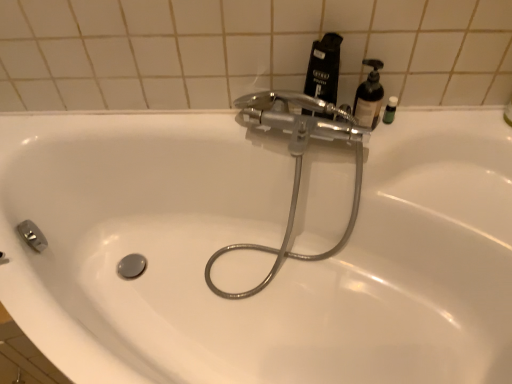
What is the approximate height of green matte bottle at upper right?

It is 2.89 inches.

Identify the location of polished chrome faucet at upper center. (295, 164).

Locate an element on the screen. The height and width of the screenshot is (384, 512). translucent plastic soap dispenser at upper right is located at coordinates click(369, 97).

You are a GUI agent. You are given a task and a screenshot of the screen. Output one action in this format:
    pyautogui.click(x=<x>, y=<y>)
    Task: Click on the green matte bottle at upper right
    The width and height of the screenshot is (512, 384).
    Given the screenshot: What is the action you would take?
    pyautogui.click(x=390, y=110)

Considering the positions of objects black matte bottle at upper right and polished chrome faucet at upper center in the image provided, who is in front, black matte bottle at upper right or polished chrome faucet at upper center?

polished chrome faucet at upper center is in front.

Is black matte bottle at upper right oriented away from polished chrome faucet at upper center?

No, black matte bottle at upper right's orientation is not away from polished chrome faucet at upper center.

You are a GUI agent. You are given a task and a screenshot of the screen. Output one action in this format:
    pyautogui.click(x=<x>, y=<y>)
    Task: Click on the plumbing fixture that appears on the left of black matte bottle at upper right
    This screenshot has width=512, height=384.
    Given the screenshot: What is the action you would take?
    pyautogui.click(x=295, y=164)

Considering the sizes of black matte bottle at upper right and polished chrome faucet at upper center in the image, is black matte bottle at upper right wider or thinner than polished chrome faucet at upper center?

black matte bottle at upper right is thinner than polished chrome faucet at upper center.

In terms of width, does green matte bottle at upper right look wider or thinner when compared to translucent plastic soap dispenser at upper right?

Considering their sizes, green matte bottle at upper right looks slimmer than translucent plastic soap dispenser at upper right.

Is point (390, 101) closer or farther from the camera than point (379, 77)?

Clearly, point (390, 101) is more distant from the camera than point (379, 77).

From the image's perspective, between green matte bottle at upper right and translucent plastic soap dispenser at upper right, which one is located above?

translucent plastic soap dispenser at upper right appears higher in the image.

Considering the sizes of objects green matte bottle at upper right and translucent plastic soap dispenser at upper right in the image provided, who is bigger, green matte bottle at upper right or translucent plastic soap dispenser at upper right?

translucent plastic soap dispenser at upper right is bigger.

Which is more to the left, black matte bottle at upper right or translucent plastic soap dispenser at upper right?

From the viewer's perspective, black matte bottle at upper right appears more on the left side.

Looking at this image, would you say black matte bottle at upper right is inside or outside translucent plastic soap dispenser at upper right?

The correct answer is: outside.

Is black matte bottle at upper right facing towards translucent plastic soap dispenser at upper right?

No, black matte bottle at upper right is not aimed at translucent plastic soap dispenser at upper right.

Which is behind, point (329, 33) or point (376, 96)?

Point (376, 96)

Considering the sizes of black matte bottle at upper right and green matte bottle at upper right in the image, is black matte bottle at upper right taller or shorter than green matte bottle at upper right?

Considering their sizes, black matte bottle at upper right has more height than green matte bottle at upper right.

From a real-world perspective, between black matte bottle at upper right and green matte bottle at upper right, who is vertically lower?

green matte bottle at upper right, from a real-world perspective.

Is black matte bottle at upper right aimed at green matte bottle at upper right?

No, black matte bottle at upper right is not facing towards green matte bottle at upper right.

Is black matte bottle at upper right located within translucent plastic soap dispenser at upper right?

No, translucent plastic soap dispenser at upper right does not contain black matte bottle at upper right.

Which object is further away from the camera taking this photo, translucent plastic soap dispenser at upper right or black matte bottle at upper right?

translucent plastic soap dispenser at upper right is further from the camera.

From a real-world perspective, is translucent plastic soap dispenser at upper right positioned under black matte bottle at upper right based on gravity?

Correct, in the physical world, translucent plastic soap dispenser at upper right is lower than black matte bottle at upper right.

Based on the photo, considering the sizes of translucent plastic soap dispenser at upper right and black matte bottle at upper right in the image, is translucent plastic soap dispenser at upper right taller or shorter than black matte bottle at upper right?

Considering their sizes, translucent plastic soap dispenser at upper right has less height than black matte bottle at upper right.

Which is less distant, (218, 290) or (359, 120)?

The point (359, 120) is in front.

Considering the relative sizes of polished chrome faucet at upper center and translucent plastic soap dispenser at upper right in the image provided, is polished chrome faucet at upper center smaller than translucent plastic soap dispenser at upper right?

Incorrect, polished chrome faucet at upper center is not smaller in size than translucent plastic soap dispenser at upper right.

Does polished chrome faucet at upper center touch translucent plastic soap dispenser at upper right?

No, polished chrome faucet at upper center is not next to translucent plastic soap dispenser at upper right.

From the image's perspective, is polished chrome faucet at upper center positioned above or below translucent plastic soap dispenser at upper right?

Clearly, from the image's perspective, polished chrome faucet at upper center is below translucent plastic soap dispenser at upper right.

Is green matte bottle at upper right aimed at polished chrome faucet at upper center?

Yes, green matte bottle at upper right is turned towards polished chrome faucet at upper center.

How far apart are green matte bottle at upper right and polished chrome faucet at upper center?

30.70 centimeters.

From the image's perspective, is green matte bottle at upper right under polished chrome faucet at upper center?

No, from the image's perspective, green matte bottle at upper right is not beneath polished chrome faucet at upper center.

Which of these two, green matte bottle at upper right or polished chrome faucet at upper center, is smaller?

green matte bottle at upper right is smaller.

Where is `plumbing fixture below the black matte bottle at upper right (from the image's perspective)`? The width and height of the screenshot is (512, 384). plumbing fixture below the black matte bottle at upper right (from the image's perspective) is located at coordinates (295, 164).

The height and width of the screenshot is (384, 512). What are the coordinates of `toiletry on the right side of translucent plastic soap dispenser at upper right` in the screenshot? It's located at (390, 110).

Based on their spatial positions, is black matte bottle at upper right or green matte bottle at upper right further from translucent plastic soap dispenser at upper right?

black matte bottle at upper right lies further to translucent plastic soap dispenser at upper right than the other object.

Considering their positions, is black matte bottle at upper right positioned further to polished chrome faucet at upper center than green matte bottle at upper right?

green matte bottle at upper right lies further to polished chrome faucet at upper center than the other object.

Based on their spatial positions, is polished chrome faucet at upper center or black matte bottle at upper right further from green matte bottle at upper right?

polished chrome faucet at upper center is positioned further to the anchor green matte bottle at upper right.

Based on their spatial positions, is black matte bottle at upper right or polished chrome faucet at upper center closer to translucent plastic soap dispenser at upper right?

Based on the image, black matte bottle at upper right appears to be nearer to translucent plastic soap dispenser at upper right.

From the image, which object appears to be farther from polished chrome faucet at upper center, green matte bottle at upper right or translucent plastic soap dispenser at upper right?

green matte bottle at upper right.

Estimate the real-world distances between objects in this image. Which object is further from polished chrome faucet at upper center, green matte bottle at upper right or black matte bottle at upper right?

green matte bottle at upper right is further to polished chrome faucet at upper center.

Looking at the image, which one is located closer to black matte bottle at upper right, green matte bottle at upper right or polished chrome faucet at upper center?

polished chrome faucet at upper center is closer to black matte bottle at upper right.

Looking at the image, which one is located further to translucent plastic soap dispenser at upper right, green matte bottle at upper right or black matte bottle at upper right?

black matte bottle at upper right lies further to translucent plastic soap dispenser at upper right than the other object.

Find the location of `soap dispenser located between polished chrome faucet at upper center and green matte bottle at upper right in the depth direction`. soap dispenser located between polished chrome faucet at upper center and green matte bottle at upper right in the depth direction is located at coordinates (369, 97).

I want to click on soap dispenser between black matte bottle at upper right and green matte bottle at upper right, so click(x=369, y=97).

You are a GUI agent. You are given a task and a screenshot of the screen. Output one action in this format:
    pyautogui.click(x=<x>, y=<y>)
    Task: Click on the soap dispenser between black matte bottle at upper right and polished chrome faucet at upper center from top to bottom
    
    Given the screenshot: What is the action you would take?
    pyautogui.click(x=369, y=97)

At what (x,y) coordinates should I click in order to perform the action: click on toiletry between black matte bottle at upper right and polished chrome faucet at upper center vertically. Please return your answer as a coordinate pair (x, y). Looking at the image, I should click on (390, 110).